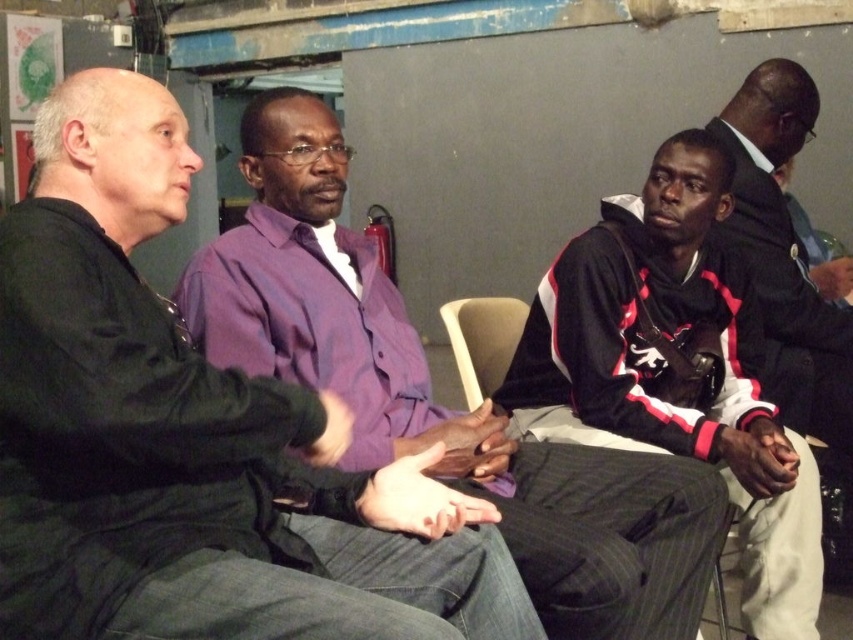
Question: Which object appears closest to the camera in this image?

Choices:
 (A) beige fabric chair at center
 (B) purple button-down shirt at center
 (C) light brown wood chair at center
 (D) black jersey at center

Answer: (B)

Question: Can you confirm if purple button-down shirt at center is wider than black jersey at center?

Choices:
 (A) yes
 (B) no

Answer: (A)

Question: Which object is the farthest from the light brown wood chair at center?

Choices:
 (A) purple button-down shirt at center
 (B) beige fabric chair at center
 (C) black jersey at center

Answer: (A)

Question: Does beige fabric chair at center have a larger size compared to light brown wood chair at center?

Choices:
 (A) yes
 (B) no

Answer: (A)

Question: Among these objects, which one is farthest from the camera?

Choices:
 (A) beige fabric chair at center
 (B) black leather jacket at right
 (C) black jersey at center

Answer: (A)

Question: Is black leather jacket at right to the right of light brown wood chair at center from the viewer's perspective?

Choices:
 (A) yes
 (B) no

Answer: (A)